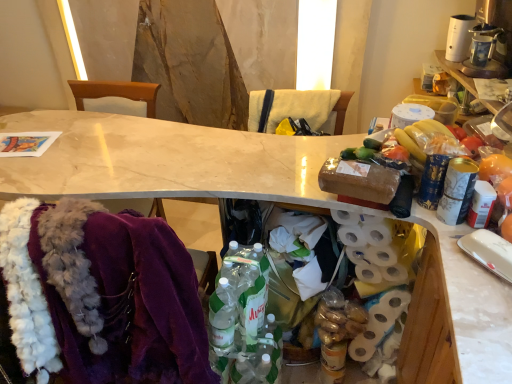
Question: In terms of size, does brown fabric chair at center, the 1th chair positioned from the right, appear bigger or smaller than translucent plastic bottles at center?

Choices:
 (A) big
 (B) small

Answer: (A)

Question: From a real-world perspective, is brown fabric chair at center, the 1th chair positioned from the right, physically located above or below translucent plastic bottles at center?

Choices:
 (A) below
 (B) above

Answer: (B)

Question: Which object is positioned closest to the yellow fabric at upper center?

Choices:
 (A) translucent plastic bottles at center
 (B) white marble desk at center
 (C) purple fabric chair at left, the first chair viewed from the left
 (D) white matte toilet paper at right
 (E) brown fabric chair at center, which is the second chair from left to right

Answer: (B)

Question: Which object is the closest to the velvet fur scarf at lower left?

Choices:
 (A) purple fabric chair at left, positioned as the 2th chair in right-to-left order
 (B) translucent plastic bottles at center
 (C) brown fabric chair at center, the 1th chair positioned from the right
 (D) white marble desk at center
 (E) yellow fabric at upper center

Answer: (B)